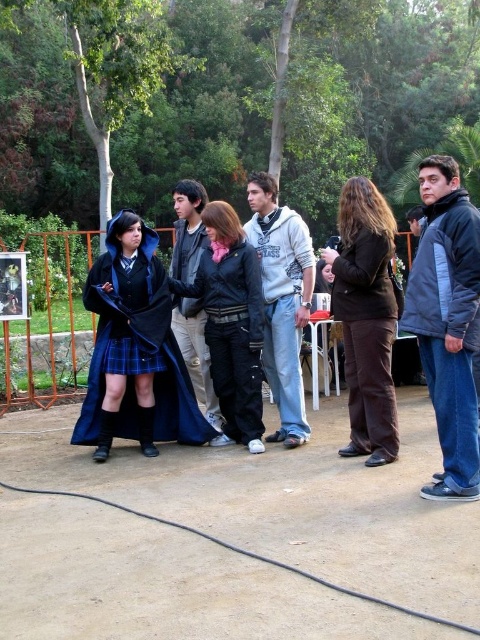
You are organizing a costume party and need to decide which outfit to wear. You have two options in the image, the matte blue coat at center and the dark blue leather jacket at center. Based on their sizes, which one would allow you to move more freely in tight spaces?

The matte blue coat at center has a lesser width compared to the dark blue leather jacket at center, so the matte blue coat at center would allow you to move more freely in tight spaces since it is narrower.

You are standing at the camera position and want to throw a frisbee to a friend who is holding the leather jacket at center. If the frisbee can travel 5 meters, will it reach them?

The distance between the leather jacket at center and the camera is 4.81 meters. Since the frisbee can travel 5 meters, it will reach them.